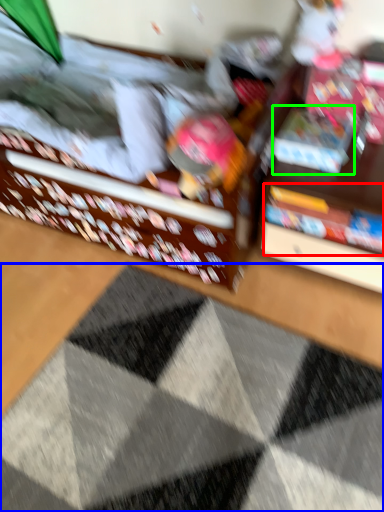
Question: Which object is positioned closest to book (highlighted by a red box)? Select from doormat (highlighted by a blue box) and book (highlighted by a green box).

Choices:
 (A) doormat
 (B) book

Answer: (B)